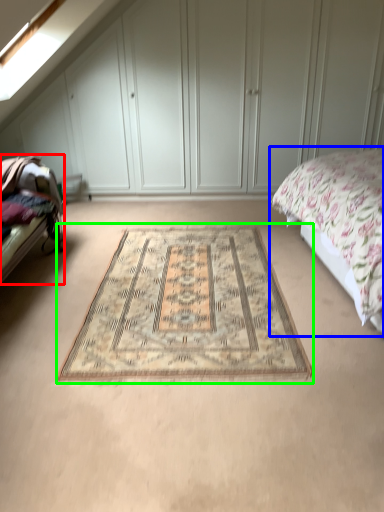
Question: Which object is positioned closest to bed frame (highlighted by a red box)? Select from bed (highlighted by a blue box) and mat (highlighted by a green box).

Choices:
 (A) bed
 (B) mat

Answer: (B)